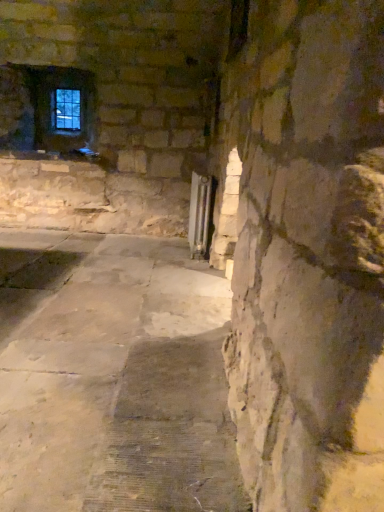
Question: Is clear glass window at upper left spatially inside silver metallic radiator at center-right, or outside of it?

Choices:
 (A) outside
 (B) inside

Answer: (A)

Question: Relative to silver metallic radiator at center-right, is clear glass window at upper left in front or behind?

Choices:
 (A) front
 (B) behind

Answer: (B)

Question: Would you say clear glass window at upper left is to the left or to the right of silver metallic radiator at center-right in the picture?

Choices:
 (A) right
 (B) left

Answer: (B)

Question: In the image, is silver metallic radiator at center-right on the left side or the right side of clear glass window at upper left?

Choices:
 (A) right
 (B) left

Answer: (A)

Question: From the image's perspective, is silver metallic radiator at center-right located above or below clear glass window at upper left?

Choices:
 (A) below
 (B) above

Answer: (A)

Question: In terms of height, does silver metallic radiator at center-right look taller or shorter compared to clear glass window at upper left?

Choices:
 (A) tall
 (B) short

Answer: (A)

Question: Is silver metallic radiator at center-right situated inside clear glass window at upper left or outside?

Choices:
 (A) outside
 (B) inside

Answer: (A)